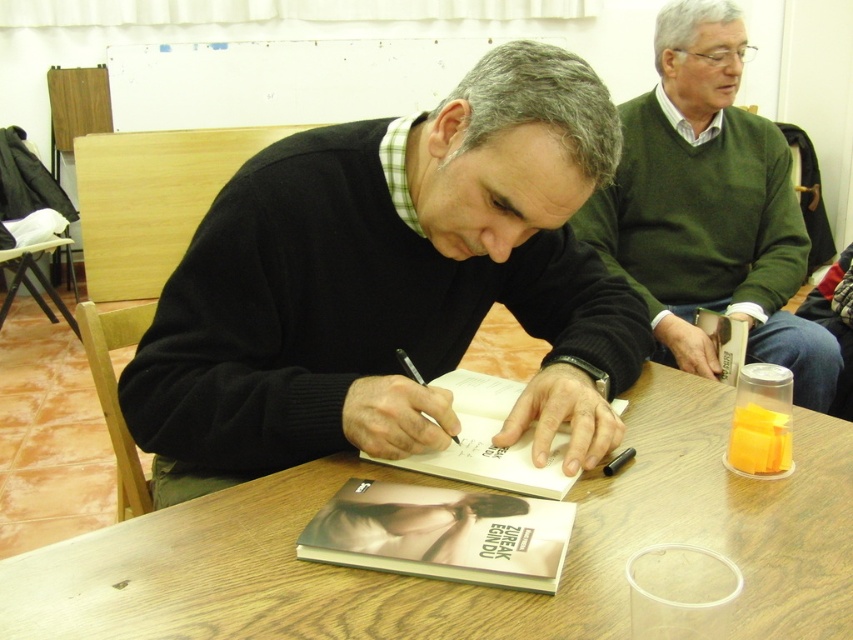
Who is positioned more to the right, wooden table at center or white paper notebook at center?

Positioned to the right is wooden table at center.

Between point (137, 525) and point (492, 483), which one is positioned behind?

The point (492, 483) is more distant.

Locate an element on the screen. The image size is (853, 640). wooden table at center is located at coordinates pos(457,582).

Between point (469, 154) and point (515, 461), which one is positioned in front?

Positioned in front is point (469, 154).

Is black sweater at center closer to camera compared to white paper notebook at center?

No, black sweater at center is behind white paper notebook at center.

Who is more forward, (572,442) or (531,426)?

Point (572,442) is more forward.

Image resolution: width=853 pixels, height=640 pixels. What are the coordinates of `black sweater at center` in the screenshot? It's located at (392, 285).

Can you confirm if soft matte cover at center is bigger than black paper at center?

Indeed, soft matte cover at center has a larger size compared to black paper at center.

The width and height of the screenshot is (853, 640). I want to click on soft matte cover at center, so click(x=440, y=532).

Where is `soft matte cover at center`? The image size is (853, 640). soft matte cover at center is located at coordinates click(x=440, y=532).

Find the location of `soft matte cover at center`. soft matte cover at center is located at coordinates (440, 532).